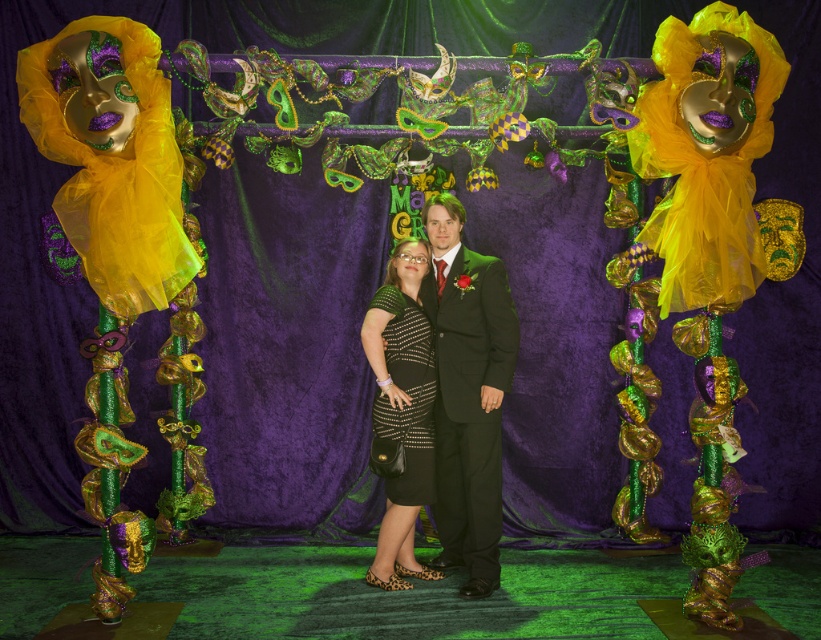
Is shiny black dress at center below black sequined dress at center?

No.

Who is lower down, shiny black dress at center or black sequined dress at center?

black sequined dress at center is lower down.

I want to click on shiny black dress at center, so click(x=466, y=392).

Locate an element on the screen. This screenshot has height=640, width=821. shiny black dress at center is located at coordinates [466, 392].